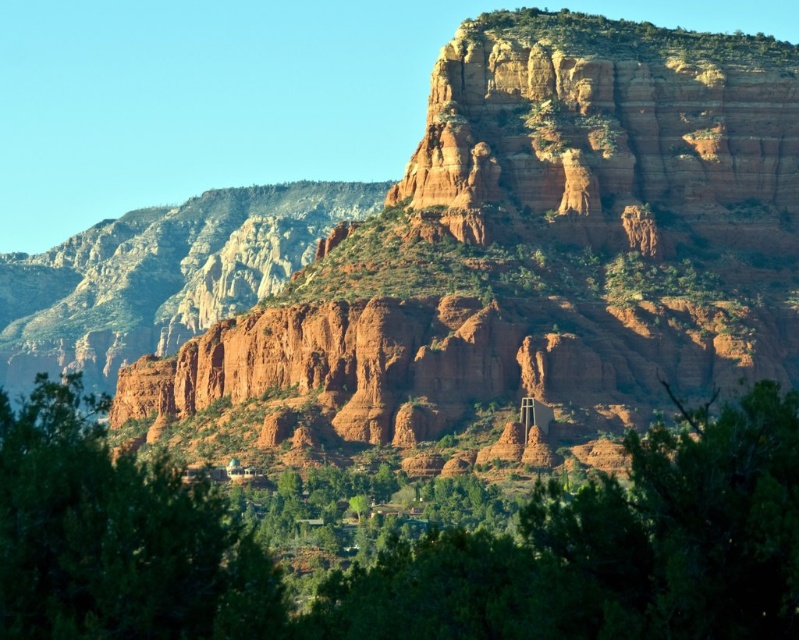
Question: Which object is positioned farthest from the rustic rock formation at center?

Choices:
 (A) green leafy tree at center
 (B) green leafy tree at lower left

Answer: (B)

Question: Does rustic rock formation at center have a smaller size compared to green leafy tree at center?

Choices:
 (A) yes
 (B) no

Answer: (B)

Question: Which of the following is the closest to the observer?

Choices:
 (A) (662, 104)
 (B) (682, 51)

Answer: (A)

Question: Is reddish-brown sandstone cliff at upper center to the left of green leafy tree at lower left from the viewer's perspective?

Choices:
 (A) no
 (B) yes

Answer: (A)

Question: Where is reddish-brown sandstone cliff at upper center located in relation to green leafy tree at lower left in the image?

Choices:
 (A) above
 (B) below

Answer: (A)

Question: Among these points, which one is farthest from the camera?

Choices:
 (A) (261, 564)
 (B) (774, 314)

Answer: (B)